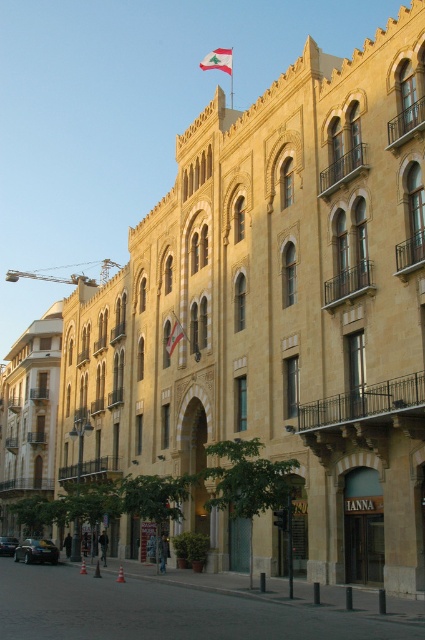
Between beige stone building at left and red fabric flag at upper center, which one appears on the left side from the viewer's perspective?

beige stone building at left is more to the left.

Can you confirm if beige stone building at left is thinner than red fabric flag at upper center?

Incorrect, beige stone building at left's width is not less than red fabric flag at upper center's.

Is point (6, 392) more distant than point (204, 60)?

No, (6, 392) is in front of (204, 60).

Where is `beige stone building at left`? This screenshot has height=640, width=425. beige stone building at left is located at coordinates [28, 413].

Does shiny black car at lower left have a greater width compared to shiny black sedan at center?

Yes.

Does shiny black car at lower left appear on the left side of shiny black sedan at center?

No, shiny black car at lower left is not to the left of shiny black sedan at center.

Is point (30, 554) farther from camera compared to point (0, 536)?

No, (30, 554) is closer to viewer.

Locate an element on the screen. The image size is (425, 640). shiny black car at lower left is located at coordinates tap(36, 552).

Who is higher up, white fabric flag at center or shiny black sedan at center?

white fabric flag at center is higher up.

Which is behind, point (173, 337) or point (0, 545)?

The point (0, 545) is behind.

You are a GUI agent. You are given a task and a screenshot of the screen. Output one action in this format:
    pyautogui.click(x=<x>, y=<y>)
    Task: Click on the white fabric flag at center
    The image size is (425, 640).
    Given the screenshot: What is the action you would take?
    pyautogui.click(x=175, y=337)